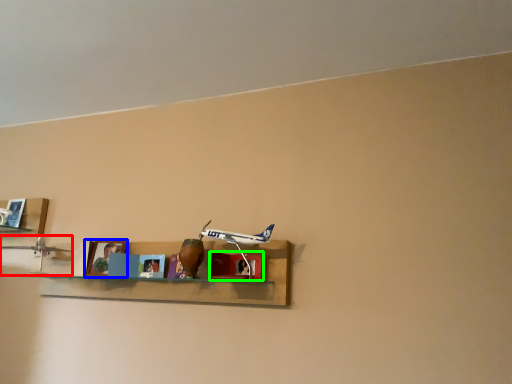
Question: Considering the real-world distances, which object is closest to toy (highlighted by a red box)? picture frame (highlighted by a blue box) or cabinet (highlighted by a green box).

Choices:
 (A) picture frame
 (B) cabinet

Answer: (A)